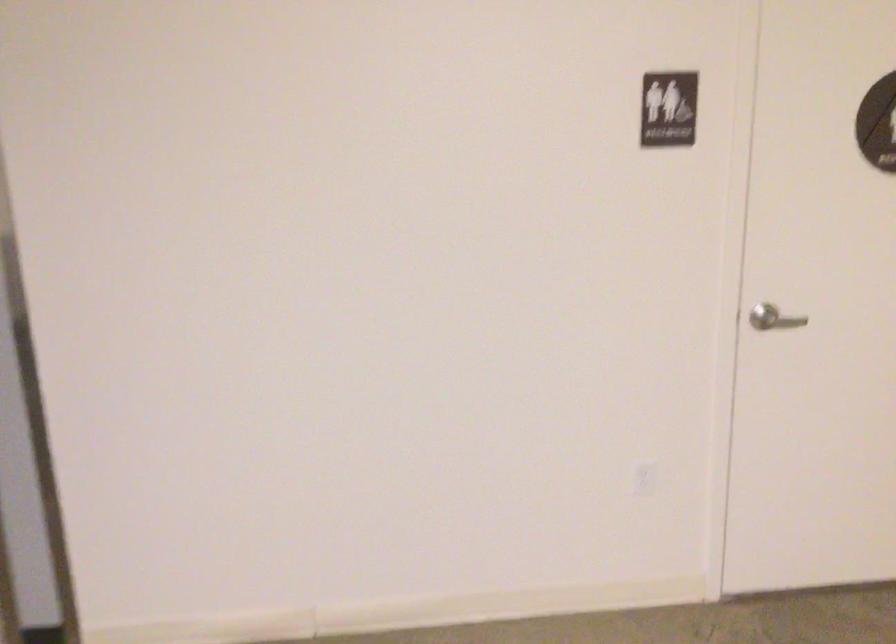
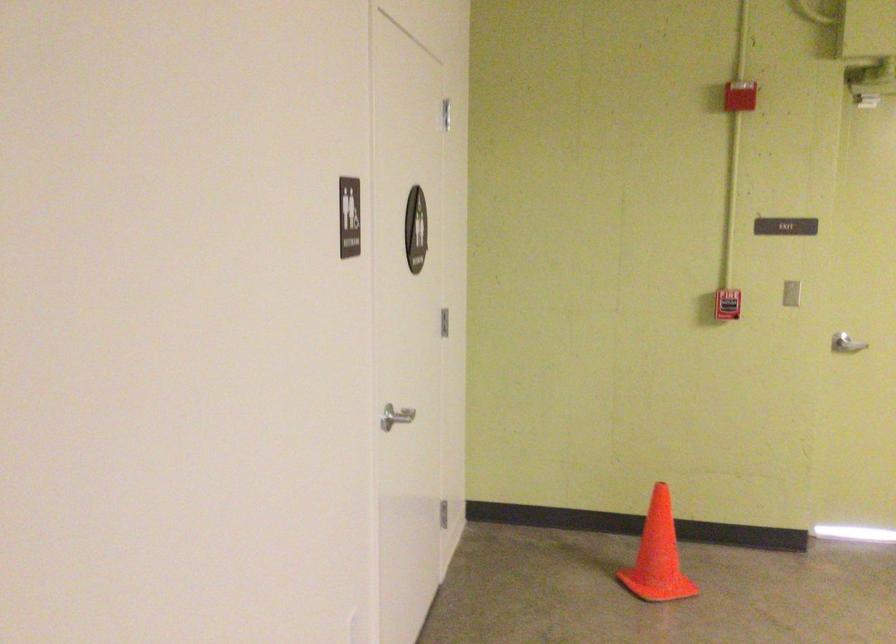
In the second image, find the point that corresponds to (780,313) in the first image.

(394, 415)